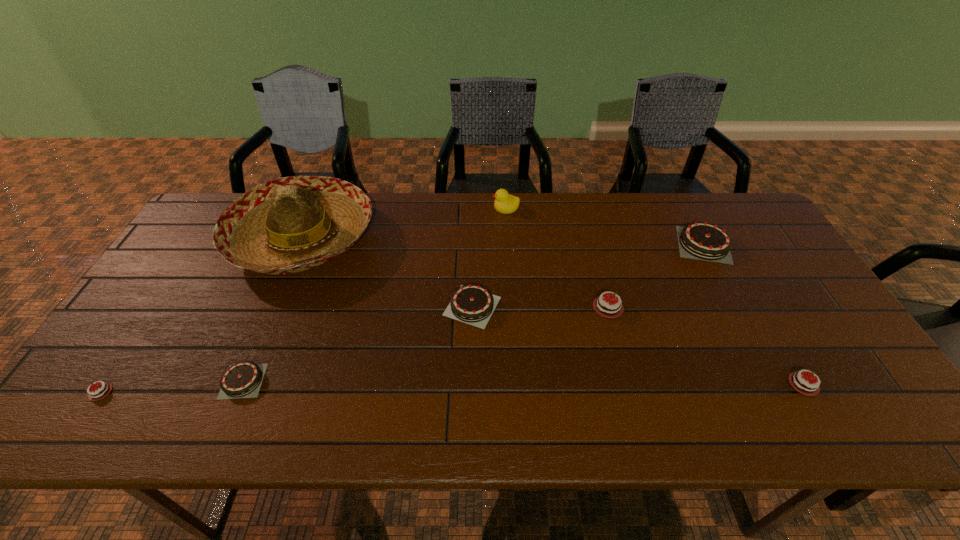
The width and height of the screenshot is (960, 540). In order to click on sombrero in this screenshot , I will do `click(291, 224)`.

You are a GUI agent. You are given a task and a screenshot of the screen. Output one action in this format:
    pyautogui.click(x=<x>, y=<y>)
    Task: Click on the tallest object
    This screenshot has height=540, width=960.
    Given the screenshot: What is the action you would take?
    tap(291, 224)

I want to click on yellow duckling, so [505, 203].

This screenshot has width=960, height=540. Find the location of `duckling`. duckling is located at coordinates (505, 203).

Find the location of a particular element. The width and height of the screenshot is (960, 540). the tallest chocolate cake is located at coordinates (702, 240).

Locate an element on the screen. This screenshot has width=960, height=540. the sixth shortest object is located at coordinates (702, 240).

Locate an element on the screen. This screenshot has height=540, width=960. the biggest red chocolate cake is located at coordinates (603, 307).

Where is `the sixth object from left to right`? The height and width of the screenshot is (540, 960). the sixth object from left to right is located at coordinates (603, 307).

At what (x,y) coordinates should I click in order to perform the action: click on the second biggest brown chocolate cake. Please return your answer as a coordinate pair (x, y). Image resolution: width=960 pixels, height=540 pixels. Looking at the image, I should click on (473, 304).

The image size is (960, 540). Find the location of `the third chocolate cake from left to right`. the third chocolate cake from left to right is located at coordinates (473, 304).